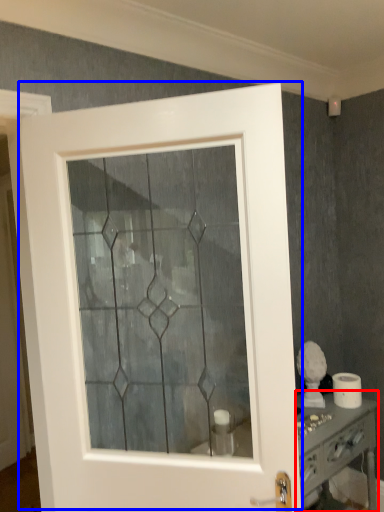
Question: Which object appears closest to the camera in this image, vanity (highlighted by a red box) or door (highlighted by a blue box)?

Choices:
 (A) vanity
 (B) door

Answer: (B)